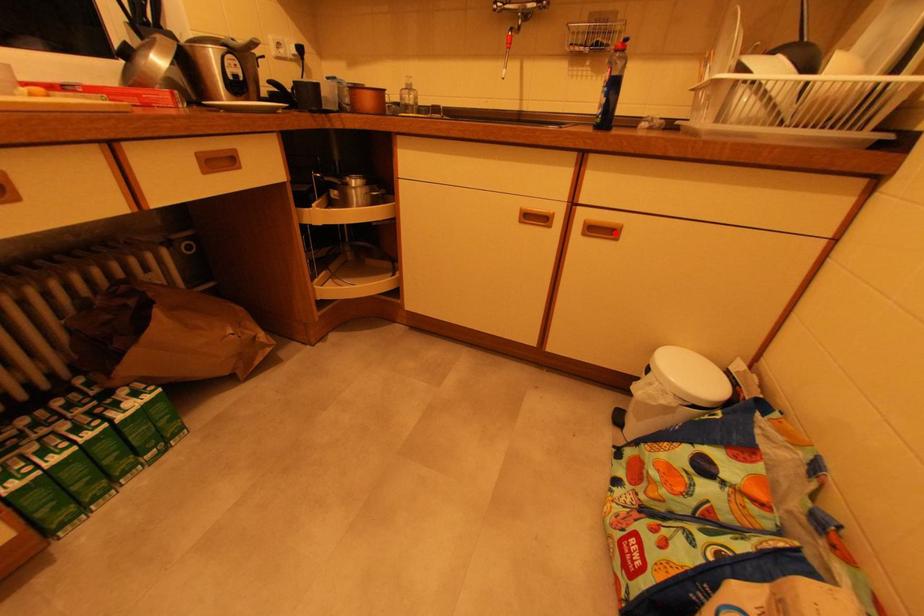
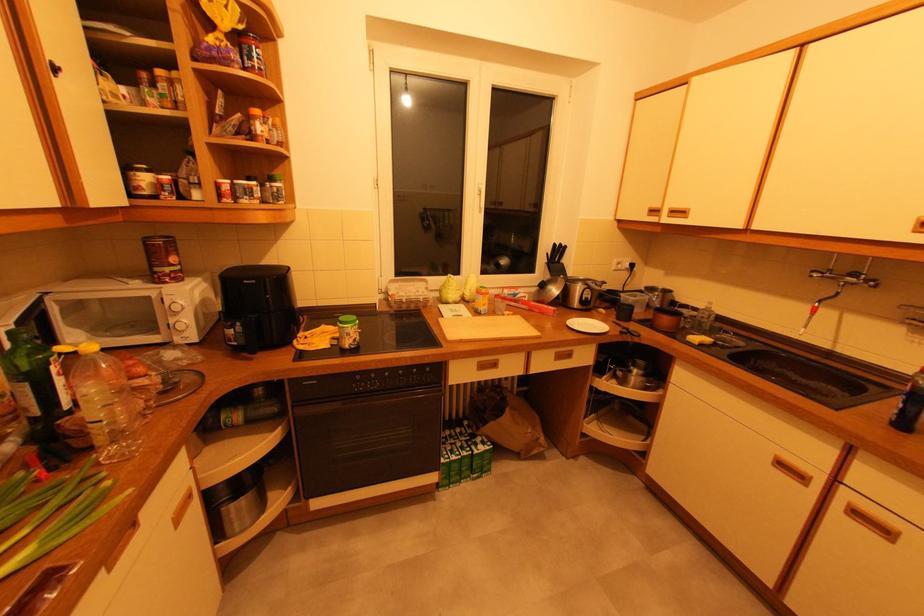
Question: I am providing you with two images of the same scene from different viewpoints. In image1, a red point is highlighted. Considering the same 3D point in image2, which of the following is correct?

Choices:
 (A) It is closer
 (B) It is farther

Answer: (B)